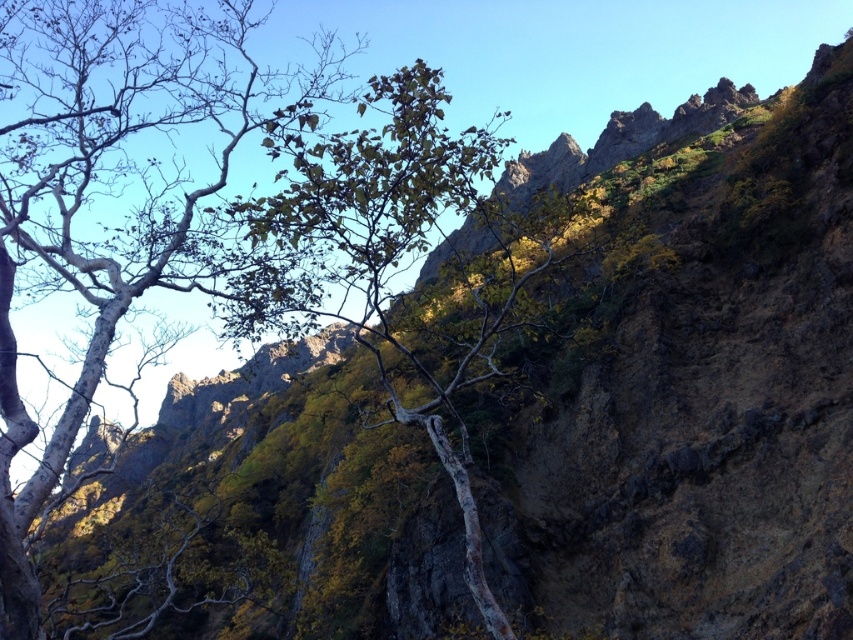
Question: Where is smooth bark tree at left located in relation to green leafy tree at center in the image?

Choices:
 (A) below
 (B) above

Answer: (B)

Question: Can you confirm if smooth bark tree at left is positioned to the right of green leafy tree at center?

Choices:
 (A) no
 (B) yes

Answer: (A)

Question: Is smooth bark tree at left bigger than green leafy tree at center?

Choices:
 (A) yes
 (B) no

Answer: (A)

Question: Which point is closer to the camera taking this photo?

Choices:
 (A) (337, 154)
 (B) (323, 67)

Answer: (A)

Question: Which object appears closest to the camera in this image?

Choices:
 (A) smooth bark tree at left
 (B) green leafy tree at center

Answer: (A)